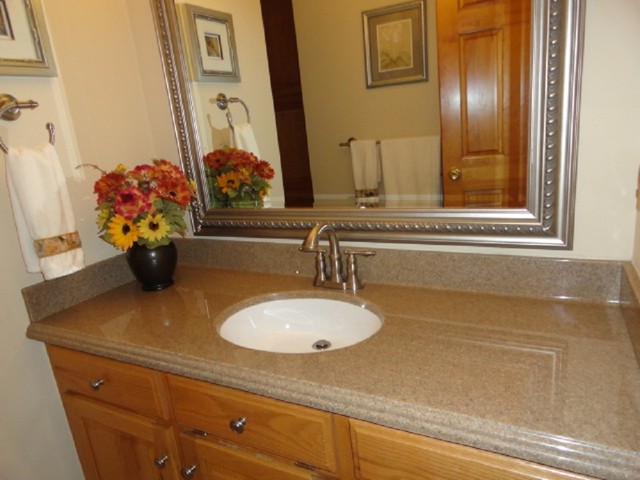
The image size is (640, 480). I want to click on sink, so click(274, 318).